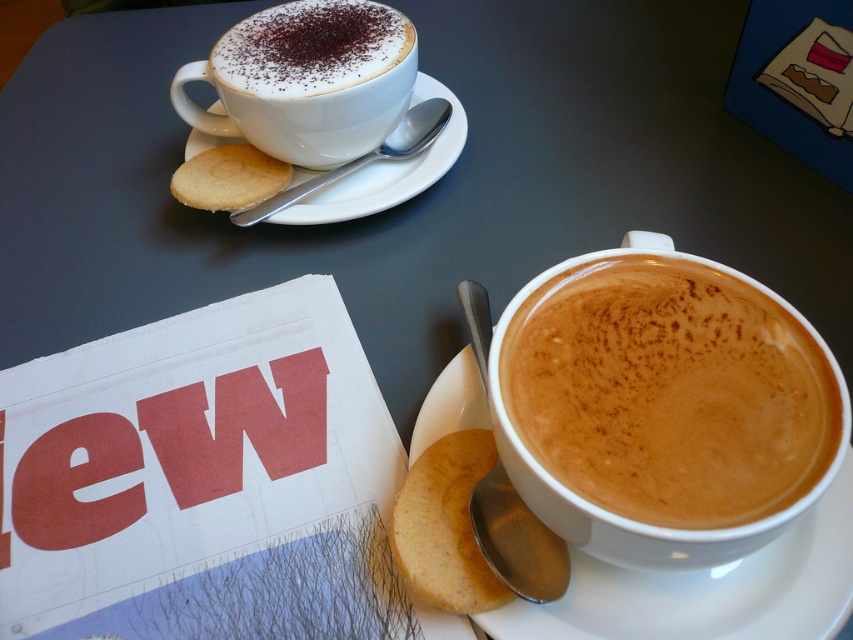
Can you confirm if cappuccino foam at lower right is positioned below golden crumbly biscuit at lower center?

No.

Looking at this image, is the position of cappuccino foam at lower right less distant than that of golden crumbly biscuit at lower center?

Yes, it is in front of golden crumbly biscuit at lower center.

Which is behind, point (688, 412) or point (432, 493)?

The point (432, 493) is behind.

Locate an element on the screen. cappuccino foam at lower right is located at coordinates (669, 392).

Can you confirm if white ceramic saucer at lower right is bigger than white ceramic saucer at upper left?

Incorrect, white ceramic saucer at lower right is not larger than white ceramic saucer at upper left.

Is white ceramic saucer at lower right closer to camera compared to white ceramic saucer at upper left?

Yes, it is in front of white ceramic saucer at upper left.

The height and width of the screenshot is (640, 853). What do you see at coordinates (708, 589) in the screenshot?
I see `white ceramic saucer at lower right` at bounding box center [708, 589].

You are a GUI agent. You are given a task and a screenshot of the screen. Output one action in this format:
    pyautogui.click(x=<x>, y=<y>)
    Task: Click on the white ceramic saucer at lower right
    Image resolution: width=853 pixels, height=640 pixels.
    Given the screenshot: What is the action you would take?
    pyautogui.click(x=708, y=589)

Who is shorter, white matte cup at upper left or white ceramic saucer at upper left?

white matte cup at upper left

Which is more to the left, white matte cup at upper left or white ceramic saucer at upper left?

white matte cup at upper left is more to the left.

Measure the distance between white matte cup at upper left and camera.

The distance of white matte cup at upper left from camera is 20.92 inches.

I want to click on white matte cup at upper left, so click(x=306, y=80).